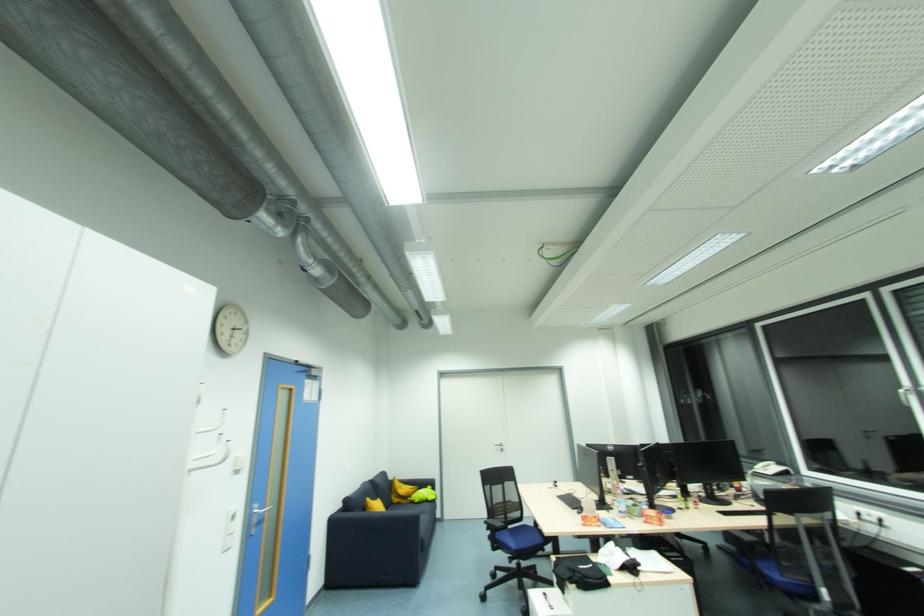
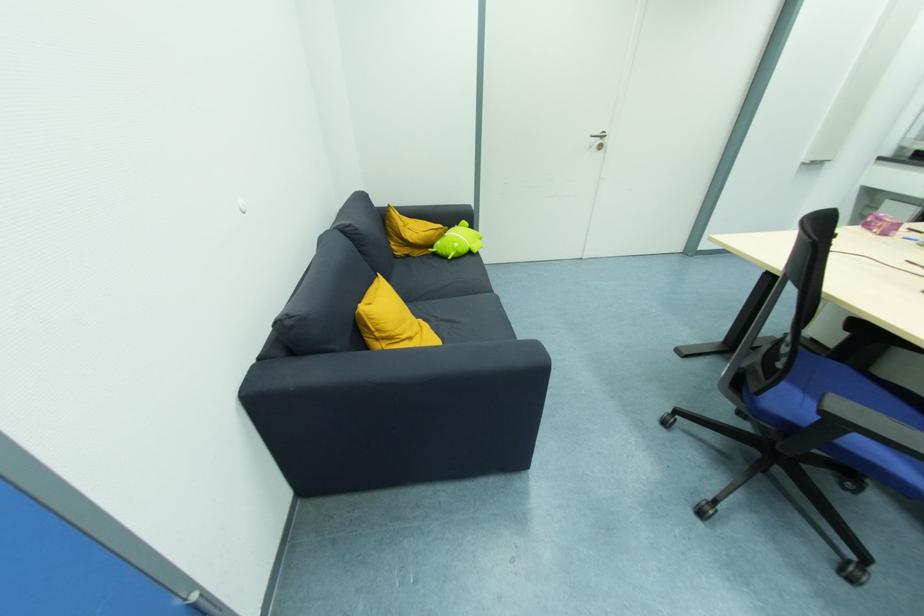
In the second image, find the point that corresponds to (505,451) in the first image.

(603, 148)